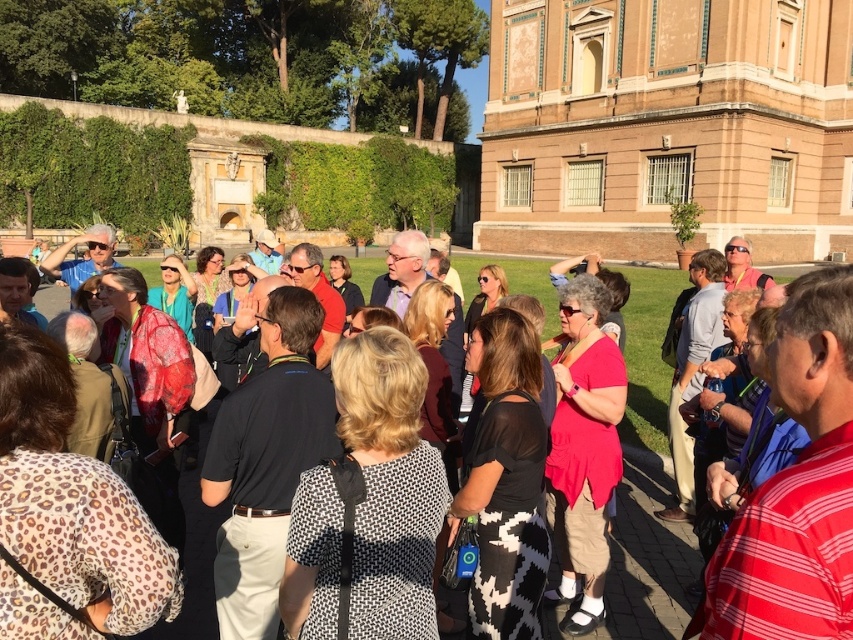
Question: Which point appears farthest from the camera in this image?

Choices:
 (A) (821, 378)
 (B) (695, 266)
 (C) (448, 387)
 (D) (757, 285)

Answer: (B)

Question: Which object is the farthest from the red striped shirt at center?

Choices:
 (A) gray fabric jacket at center
 (B) matte pink blouse at center

Answer: (A)

Question: Can you confirm if matte pink shirt at center is positioned below matte black shirt at center?

Choices:
 (A) yes
 (B) no

Answer: (A)

Question: Is red striped shirt at center thinner than matte pink shirt at center?

Choices:
 (A) no
 (B) yes

Answer: (B)

Question: Which point appears farthest from the camera in this image?

Choices:
 (A) (15, 445)
 (B) (160, 307)
 (C) (508, 368)
 (D) (828, 625)

Answer: (B)

Question: Is blonde hair at center smaller than matte pink shirt at center?

Choices:
 (A) no
 (B) yes

Answer: (B)